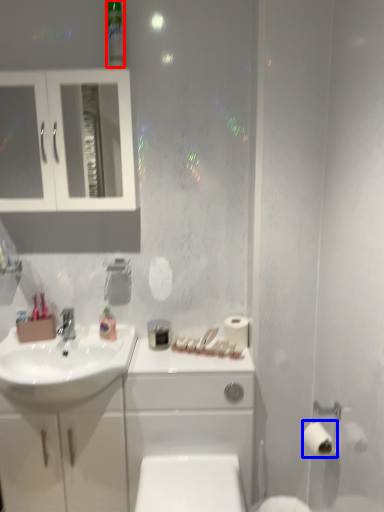
Question: Which of the following is the closest to the observer, mouthwash (highlighted by a red box) or toilet paper (highlighted by a blue box)?

Choices:
 (A) mouthwash
 (B) toilet paper

Answer: (B)